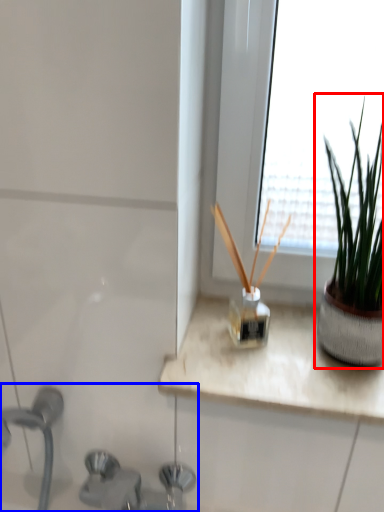
Question: Which object appears closest to the camera in this image, houseplant (highlighted by a red box) or sink (highlighted by a blue box)?

Choices:
 (A) houseplant
 (B) sink

Answer: (B)